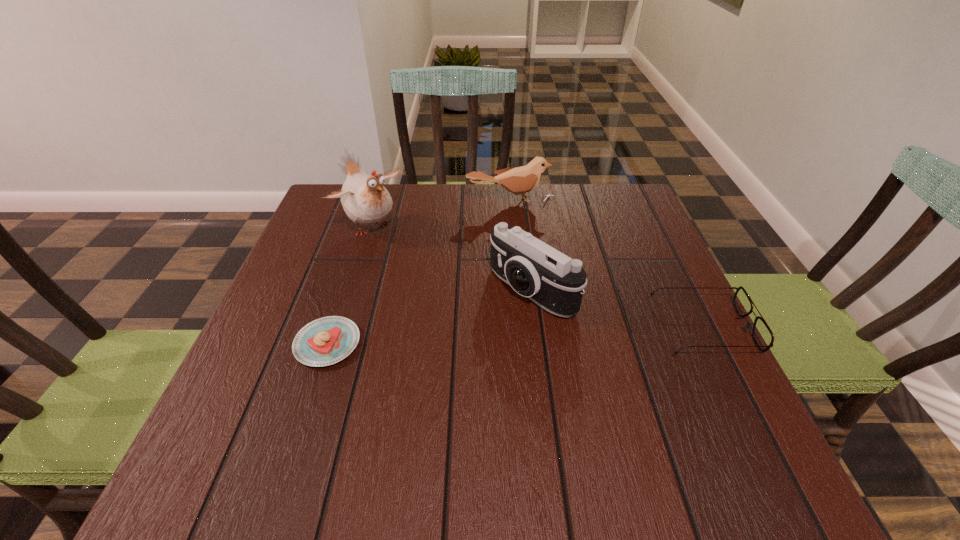
Find the location of a particular element. This screenshot has width=960, height=540. free spot located 0.400m at the beak of the tallest object is located at coordinates (493, 336).

Locate an element on the screen. Image resolution: width=960 pixels, height=540 pixels. free location located at the beak of the tallest object is located at coordinates (484, 327).

The width and height of the screenshot is (960, 540). In order to click on vacant space located on the front lens of the camera in this screenshot , I will do coord(377,400).

Identify the location of blank area located 0.250m on the front lens of the camera. (405, 380).

Where is `vacant space situated on the front lens of the camera`? The image size is (960, 540). vacant space situated on the front lens of the camera is located at coordinates (435, 359).

The image size is (960, 540). Identify the location of free space located 0.330m at the beak of the right bird. pyautogui.click(x=556, y=293).

This screenshot has width=960, height=540. Identify the location of free region located at the beak of the right bird. [553, 287].

Locate an element on the screen. This screenshot has height=540, width=960. vacant space located at the beak of the right bird is located at coordinates click(528, 230).

You are a GUI agent. You are given a task and a screenshot of the screen. Output one action in this format:
    pyautogui.click(x=<x>, y=<y>)
    Task: Click on the pastry located at the left edge
    Image resolution: width=960 pixels, height=540 pixels.
    Given the screenshot: What is the action you would take?
    pyautogui.click(x=325, y=341)

In order to click on bird located at the left edge in this screenshot , I will do `click(365, 200)`.